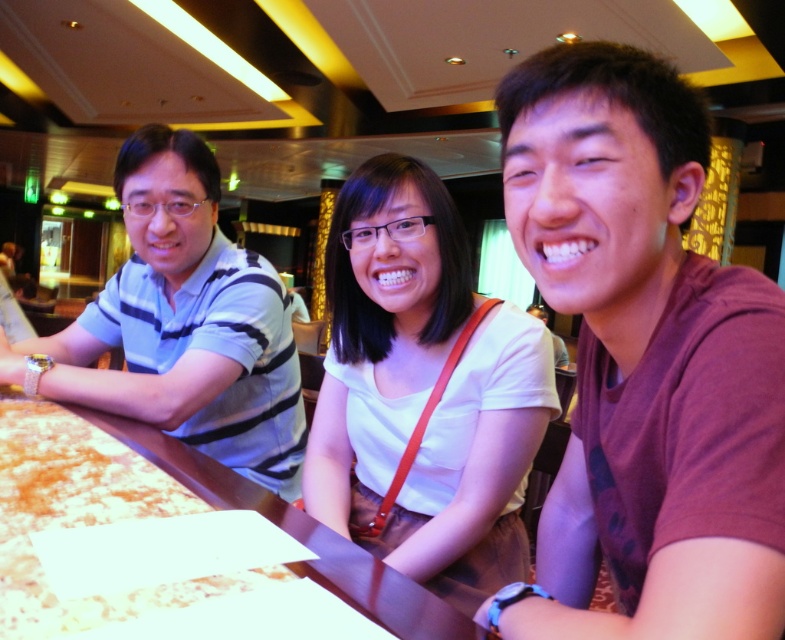
Question: Is white matte shirt at center further to the viewer compared to striped cotton shirt at left?

Choices:
 (A) yes
 (B) no

Answer: (B)

Question: Where is white matte shirt at center located in relation to striped cotton shirt at left in the image?

Choices:
 (A) above
 (B) below

Answer: (B)

Question: Which object appears closest to the camera in this image?

Choices:
 (A) white matte shirt at center
 (B) striped cotton shirt at left

Answer: (A)

Question: Based on their relative distances, which object is farther from the brown wooden table at center?

Choices:
 (A) white matte shirt at center
 (B) striped cotton shirt at left
 (C) maroon cotton t-shirt at right

Answer: (C)

Question: Is maroon cotton t-shirt at right below white matte shirt at center?

Choices:
 (A) yes
 (B) no

Answer: (A)

Question: Considering the real-world distances, which object is closest to the maroon cotton t-shirt at right?

Choices:
 (A) striped cotton shirt at left
 (B) white matte shirt at center
 (C) brown wooden table at center

Answer: (B)